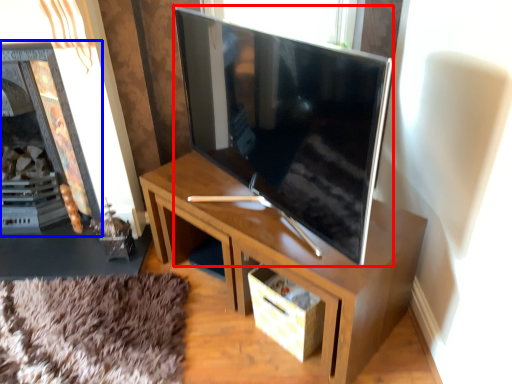
Question: Which object appears closest to the camera in this image, television (highlighted by a red box) or fireplace (highlighted by a blue box)?

Choices:
 (A) television
 (B) fireplace

Answer: (A)